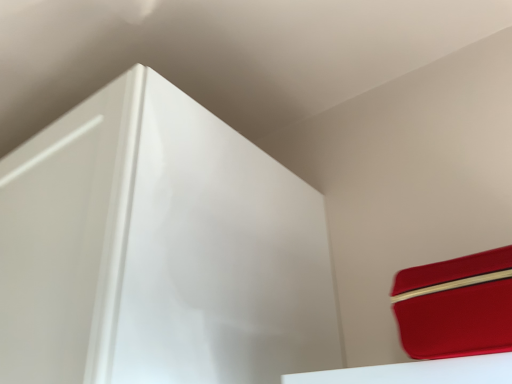
This screenshot has width=512, height=384. What do you see at coordinates (456, 306) in the screenshot?
I see `matte red suitcase at right` at bounding box center [456, 306].

At what (x,y) coordinates should I click in order to perform the action: click on matte red suitcase at right. Please return your answer as a coordinate pair (x, y). Looking at the image, I should click on (456, 306).

This screenshot has width=512, height=384. Identify the location of matte red suitcase at right. (456, 306).